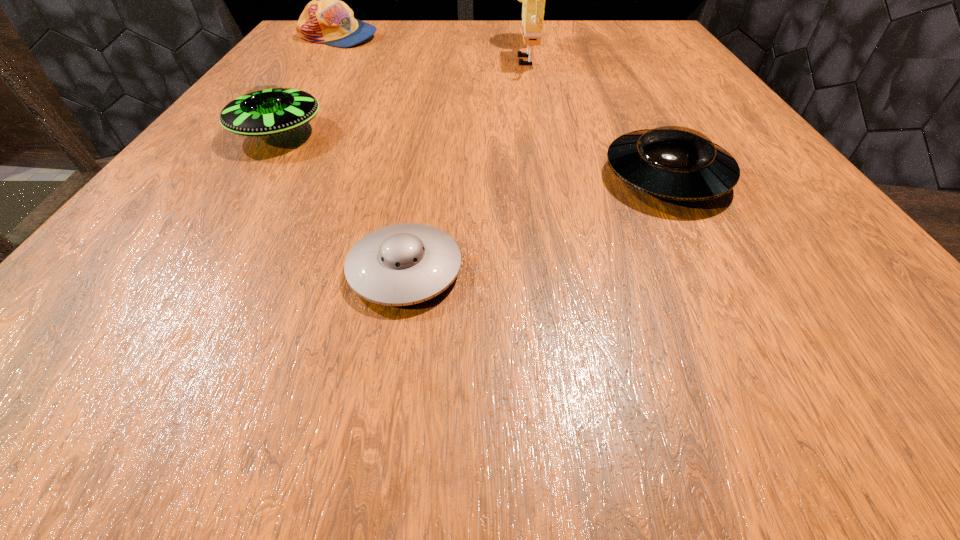
Locate an element on the screen. The image size is (960, 540). object that is at the far left corner is located at coordinates (326, 19).

In the image, there is a desktop. Where is `free space at the far edge`? free space at the far edge is located at coordinates (559, 50).

I want to click on free space at the near edge, so click(x=219, y=330).

Locate an element on the screen. The image size is (960, 540). free space at the left edge is located at coordinates (343, 79).

Image resolution: width=960 pixels, height=540 pixels. I want to click on vacant area at the right edge, so click(800, 195).

You are a GUI agent. You are given a task and a screenshot of the screen. Output one action in this format:
    pyautogui.click(x=<x>, y=<y>)
    Task: Click on the unoccupied position between the sponge and the second saucer from right to left
    The image size is (960, 540).
    Given the screenshot: What is the action you would take?
    pyautogui.click(x=467, y=162)

What are the coordinates of `empty location between the leftmost saucer and the nearest object` in the screenshot? It's located at (342, 201).

The image size is (960, 540). Find the location of `free space between the cap and the leftmost saucer`. free space between the cap and the leftmost saucer is located at coordinates [x=307, y=85].

Where is `empty space between the tallest object and the rightmost object`? The width and height of the screenshot is (960, 540). empty space between the tallest object and the rightmost object is located at coordinates (597, 116).

What are the coordinates of `vacant region between the shortest saucer and the rightmost saucer` in the screenshot? It's located at (536, 223).